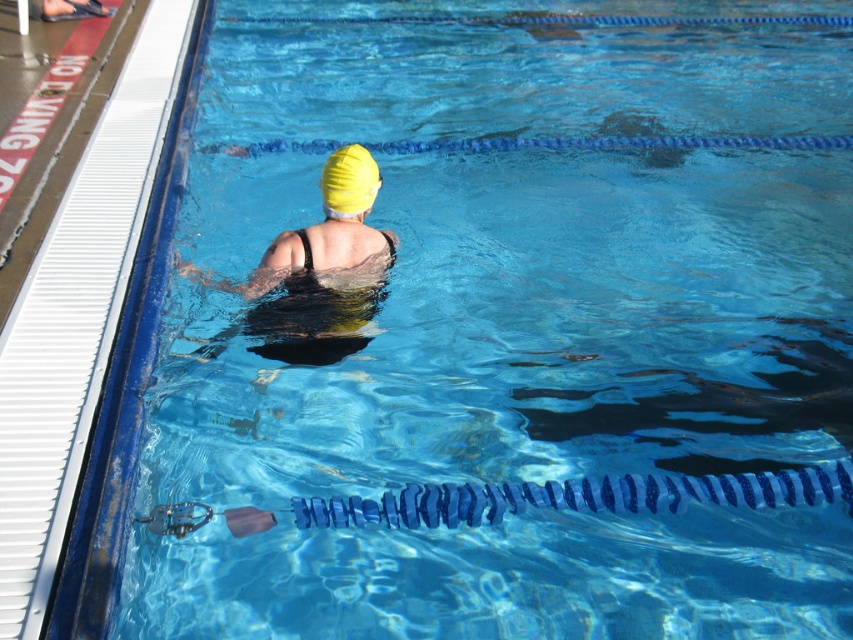
Question: Which point is farther from the camera taking this photo?

Choices:
 (A) (364, 186)
 (B) (195, 275)
 (C) (170, 513)

Answer: (B)

Question: Can you confirm if yellow matte swim cap at center is positioned below yellow matte swim cap at upper center?

Choices:
 (A) no
 (B) yes

Answer: (B)

Question: Where is yellow matte swim cap at center located in relation to transparent plastic goggles at lower center in the image?

Choices:
 (A) above
 (B) below

Answer: (A)

Question: Which point is farther to the camera?

Choices:
 (A) yellow matte swim cap at upper center
 (B) transparent plastic goggles at lower center

Answer: (A)

Question: Can you confirm if yellow matte swim cap at center is smaller than yellow matte swim cap at upper center?

Choices:
 (A) yes
 (B) no

Answer: (B)

Question: Which point appears closest to the camera in this image?

Choices:
 (A) (166, 508)
 (B) (271, 301)
 (C) (354, 179)

Answer: (A)